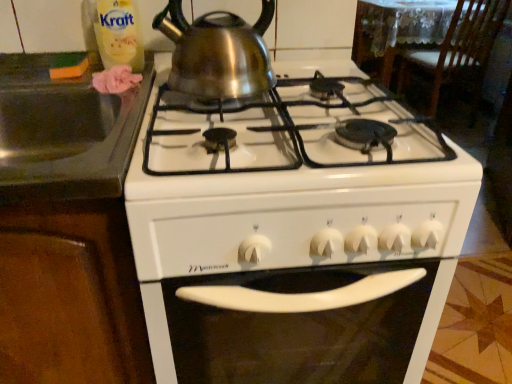
Question: From a real-world perspective, is translucent plastic bottle at upper left on top of wooden chair at upper right?

Choices:
 (A) no
 (B) yes

Answer: (B)

Question: From the image's perspective, is translucent plastic bottle at upper left above wooden chair at upper right?

Choices:
 (A) no
 (B) yes

Answer: (A)

Question: Considering the relative sizes of translucent plastic bottle at upper left and wooden chair at upper right in the image provided, is translucent plastic bottle at upper left shorter than wooden chair at upper right?

Choices:
 (A) yes
 (B) no

Answer: (A)

Question: Does translucent plastic bottle at upper left appear on the right side of wooden chair at upper right?

Choices:
 (A) yes
 (B) no

Answer: (B)

Question: Is translucent plastic bottle at upper left looking in the opposite direction of wooden chair at upper right?

Choices:
 (A) no
 (B) yes

Answer: (A)

Question: Can you confirm if translucent plastic bottle at upper left is thinner than wooden chair at upper right?

Choices:
 (A) no
 (B) yes

Answer: (B)

Question: Considering the relative positions of wooden chair at upper right and black granite sink at left in the image provided, is wooden chair at upper right to the left of black granite sink at left from the viewer's perspective?

Choices:
 (A) yes
 (B) no

Answer: (B)

Question: From the image's perspective, does wooden chair at upper right appear higher than black granite sink at left?

Choices:
 (A) no
 (B) yes

Answer: (B)

Question: Is wooden chair at upper right turned away from black granite sink at left?

Choices:
 (A) yes
 (B) no

Answer: (B)

Question: Is wooden chair at upper right in front of black granite sink at left?

Choices:
 (A) no
 (B) yes

Answer: (A)

Question: From the image's perspective, would you say wooden chair at upper right is shown under black granite sink at left?

Choices:
 (A) no
 (B) yes

Answer: (A)

Question: Does wooden chair at upper right lie behind black granite sink at left?

Choices:
 (A) yes
 (B) no

Answer: (A)

Question: Is there a large distance between white glossy gas stove at center and shiny metallic kettle at upper center?

Choices:
 (A) yes
 (B) no

Answer: (B)